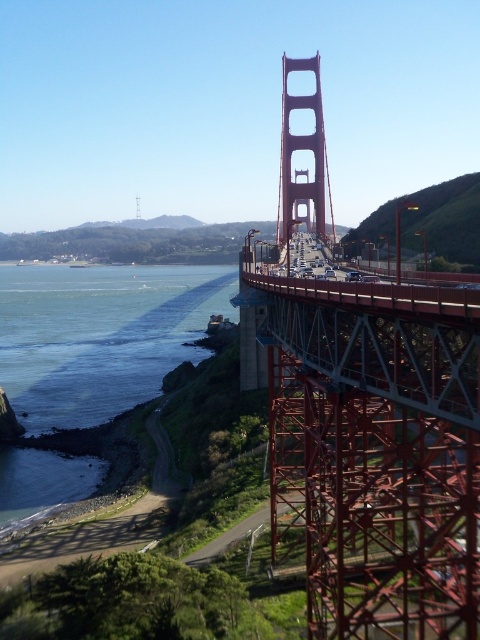
Measure the distance between red painted steel suspension bridge at center and blue water at lower left.

red painted steel suspension bridge at center is 77.59 meters away from blue water at lower left.

Which is behind, point (380, 486) or point (96, 465)?

Positioned behind is point (96, 465).

Is point (439, 404) closer to camera compared to point (61, 385)?

That is True.

The height and width of the screenshot is (640, 480). I want to click on red painted steel suspension bridge at center, so [x=369, y=429].